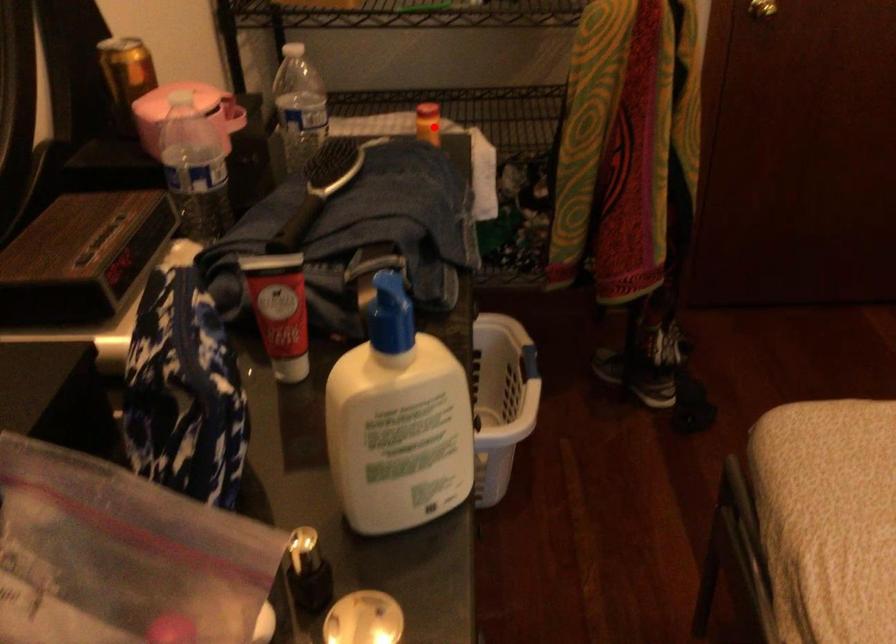
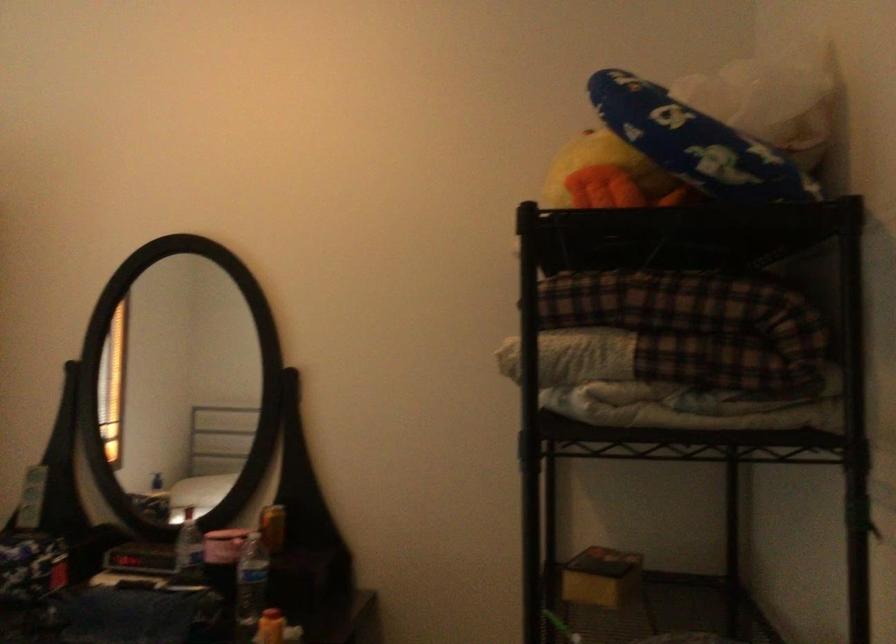
Where in the second image is the point corresponding to the highlighted location from the first image?

(270, 627)